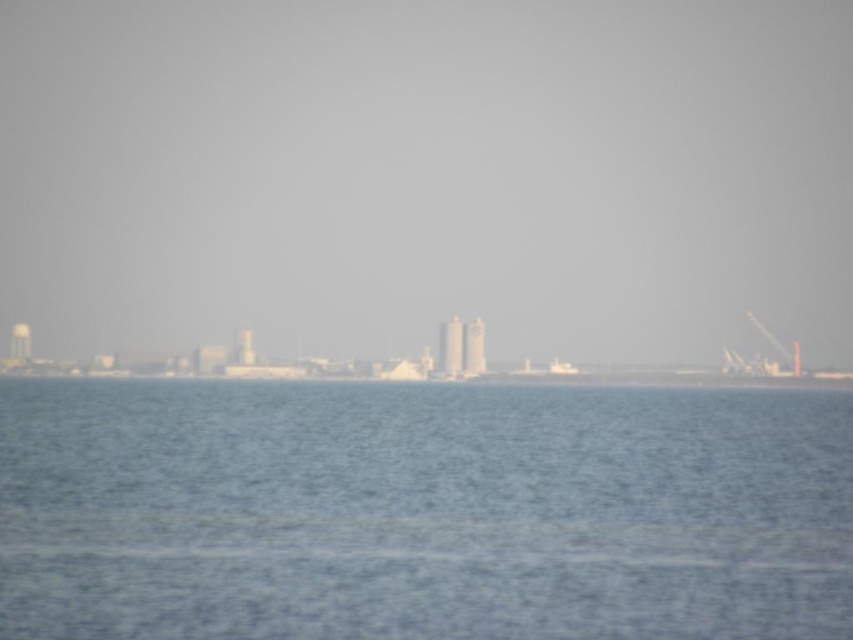
You are standing at the point marked by point (427, 176) in the image. Looking around, what do you see in the direction of the transparent glass skyscraper at center?

You are standing at point (427, 176), which marks the transparent glass skyscraper at center, so you are already at the transparent glass skyscraper at center. Therefore, looking in its direction would mean looking at the same location where you are standing.